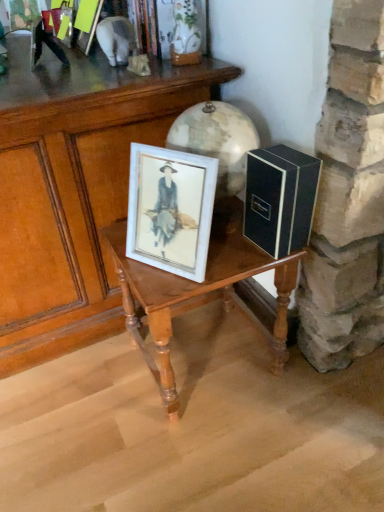
Question: Is metallic silver figurine at upper left positioned in front of black matte box at right?

Choices:
 (A) yes
 (B) no

Answer: (B)

Question: From the image's perspective, is metallic silver figurine at upper left located above black matte box at right?

Choices:
 (A) no
 (B) yes

Answer: (B)

Question: Is metallic silver figurine at upper left smaller than black matte box at right?

Choices:
 (A) yes
 (B) no

Answer: (B)

Question: From a real-world perspective, is metallic silver figurine at upper left positioned under black matte box at right based on gravity?

Choices:
 (A) yes
 (B) no

Answer: (B)

Question: Is metallic silver figurine at upper left located outside black matte box at right?

Choices:
 (A) yes
 (B) no

Answer: (A)

Question: Is metallic silver figurine at upper left to the left of black matte box at right from the viewer's perspective?

Choices:
 (A) no
 (B) yes

Answer: (B)

Question: Is wooden table at center, which is counted as the 1th table, starting from the left, looking in the opposite direction of wooden table at center, marked as the first table in a right-to-left arrangement?

Choices:
 (A) no
 (B) yes

Answer: (A)

Question: Is wooden table at center, which is counted as the 1th table, starting from the left, at the right side of wooden table at center, marked as the first table in a right-to-left arrangement?

Choices:
 (A) no
 (B) yes

Answer: (A)

Question: Does wooden table at center, which is counted as the 1th table, starting from the left, come in front of wooden table at center, marked as the first table in a right-to-left arrangement?

Choices:
 (A) no
 (B) yes

Answer: (B)

Question: Can you confirm if wooden table at center, which is the second table in right-to-left order, is bigger than wooden table at center, marked as the first table in a right-to-left arrangement?

Choices:
 (A) no
 (B) yes

Answer: (B)

Question: Considering the relative positions of wooden table at center, which is counted as the 1th table, starting from the left, and wooden table at center, marked as the first table in a right-to-left arrangement, in the image provided, is wooden table at center, which is counted as the 1th table, starting from the left, to the left of wooden table at center, marked as the first table in a right-to-left arrangement, from the viewer's perspective?

Choices:
 (A) no
 (B) yes

Answer: (B)

Question: From the image's perspective, does wooden table at center, which is the second table in right-to-left order, appear lower than wooden table at center, which ranks as the 2th table in left-to-right order?

Choices:
 (A) no
 (B) yes

Answer: (A)

Question: Considering the relative sizes of wooden table at center, which is counted as the 1th table, starting from the left, and metallic silver figurine at upper left in the image provided, is wooden table at center, which is counted as the 1th table, starting from the left, wider than metallic silver figurine at upper left?

Choices:
 (A) no
 (B) yes

Answer: (B)